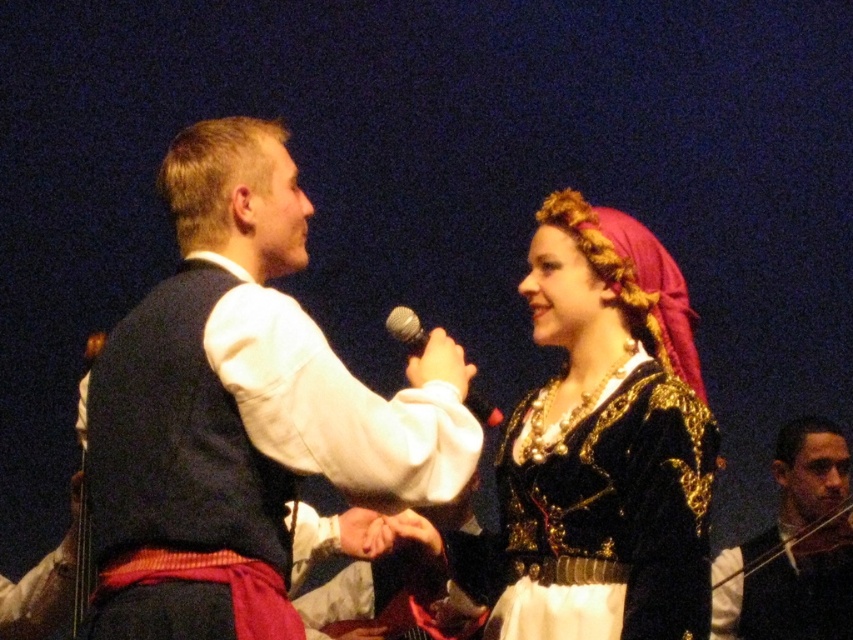
You are an event planner trying to place a decorative item between the two individuals in the scene. The man is holding a microphone and the woman is wearing a velvet black dress at center. Based on their positions, where should you place the item to ensure it is equidistant from both?

The velvet black dress at center is located at point (602, 444), so you should place the item halfway between the man and the woman to ensure it is equidistant from both.

You are a stagehand preparing to adjust the lighting for the performers. The velvet vest at center and metallic silver microphone at center are both in your line of sight. Which object is wider?

The velvet vest at center is wider than the metallic silver microphone at center based on their widths.